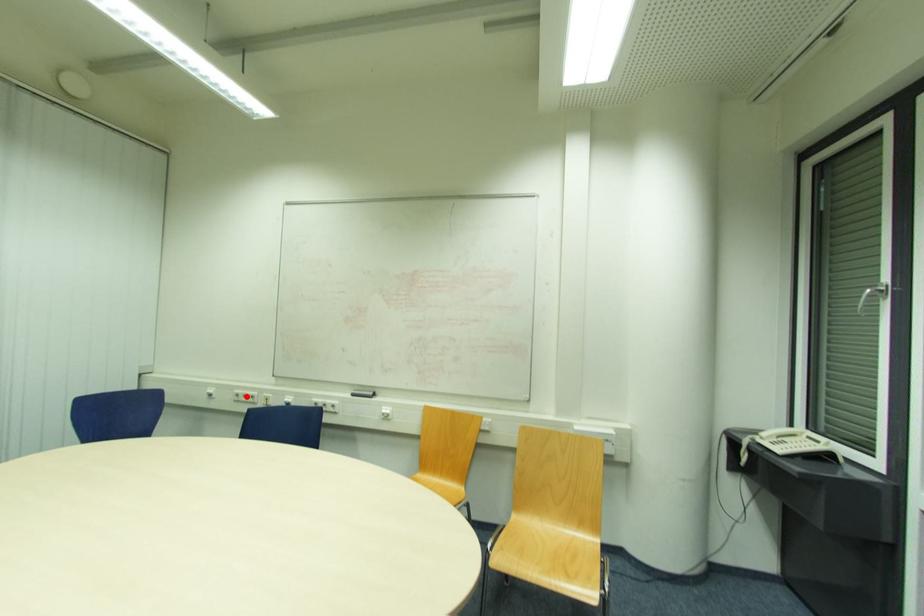
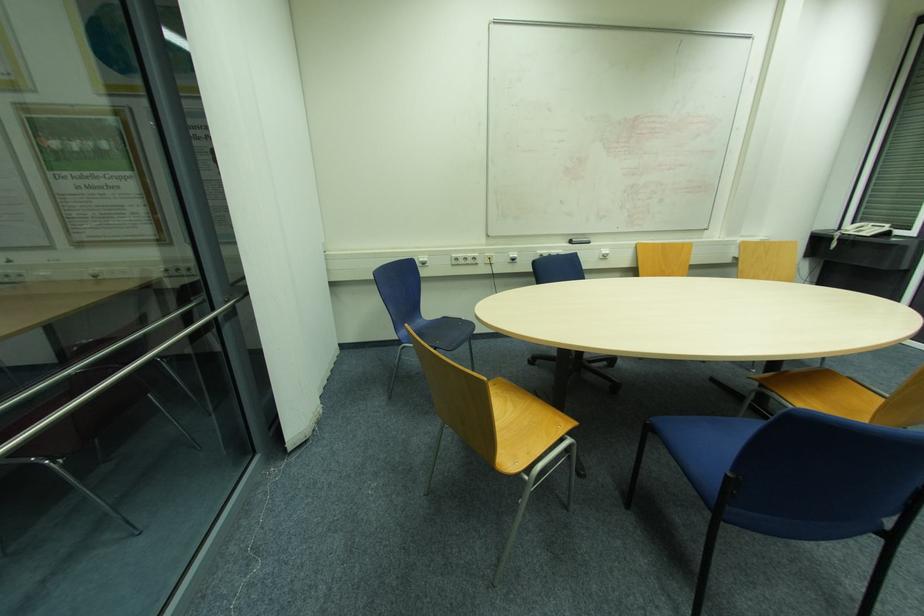
Question: I am providing you with two images of the same scene from different viewpoints. A red point is shown in image1. For the corresponding object point in image2, is it positioned nearer or farther from the camera?

Choices:
 (A) Nearer
 (B) Farther

Answer: (A)